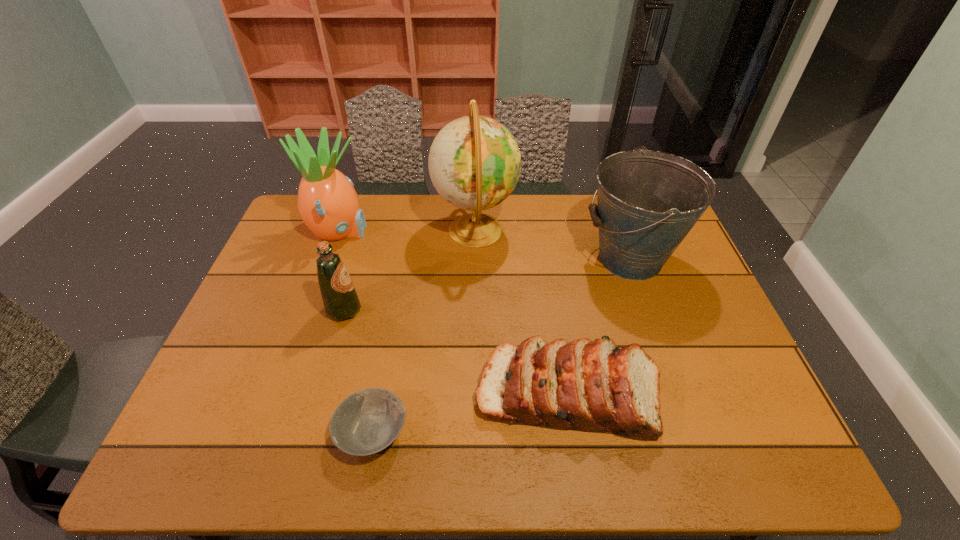
You are a GUI agent. You are given a task and a screenshot of the screen. Output one action in this format:
    pyautogui.click(x=<x>, y=<y>)
    Task: Click on the free space located with the handle on opposite sides of the bucket
    
    Given the screenshot: What is the action you would take?
    pyautogui.click(x=492, y=259)

Identify the location of vacant area situated 0.290m with the handle on opposite sides of the bucket. (489, 259).

The image size is (960, 540). In order to click on vacant space located with the handle on opposite sides of the bucket in this screenshot , I will do `click(483, 259)`.

This screenshot has width=960, height=540. I want to click on vacant area located 0.400m on the front-facing side of the olive oil, so click(x=503, y=309).

This screenshot has height=540, width=960. Identify the location of free space located on the right of the fifth tallest object. (757, 393).

This screenshot has height=540, width=960. I want to click on free space located on the right of the shortest object, so click(519, 432).

Find the location of a particular element. This screenshot has width=960, height=540. globe at the far edge is located at coordinates (474, 162).

At what (x,y) coordinates should I click in order to perform the action: click on pineapple at the far edge. Please return your answer as a coordinate pair (x, y). Image resolution: width=960 pixels, height=540 pixels. Looking at the image, I should click on (327, 202).

Where is `bucket located at the far edge`? This screenshot has width=960, height=540. bucket located at the far edge is located at coordinates (648, 201).

Find the location of `bread that is positioned at the near edge`. bread that is positioned at the near edge is located at coordinates (594, 386).